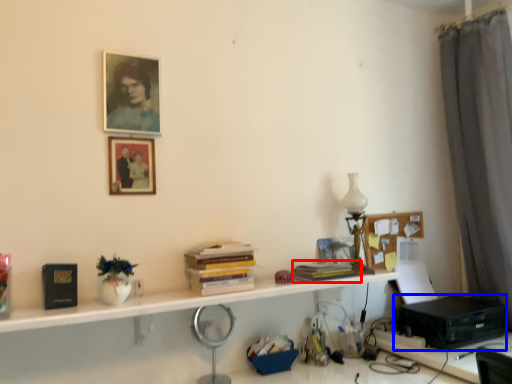
Question: Which point is closer to the camera, book (highlighted by a red box) or printer (highlighted by a blue box)?

Choices:
 (A) book
 (B) printer

Answer: (A)